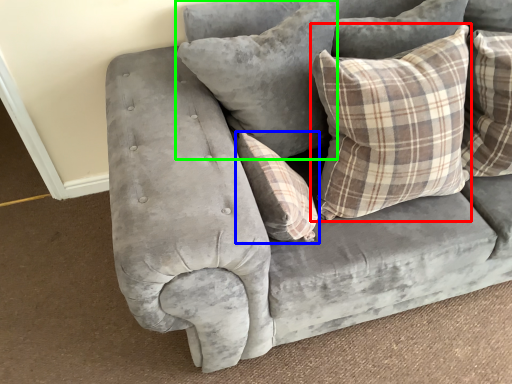
Question: Considering the real-world distances, which object is closest to pillow (highlighted by a red box)? pillow (highlighted by a blue box) or pillow (highlighted by a green box).

Choices:
 (A) pillow
 (B) pillow

Answer: (B)